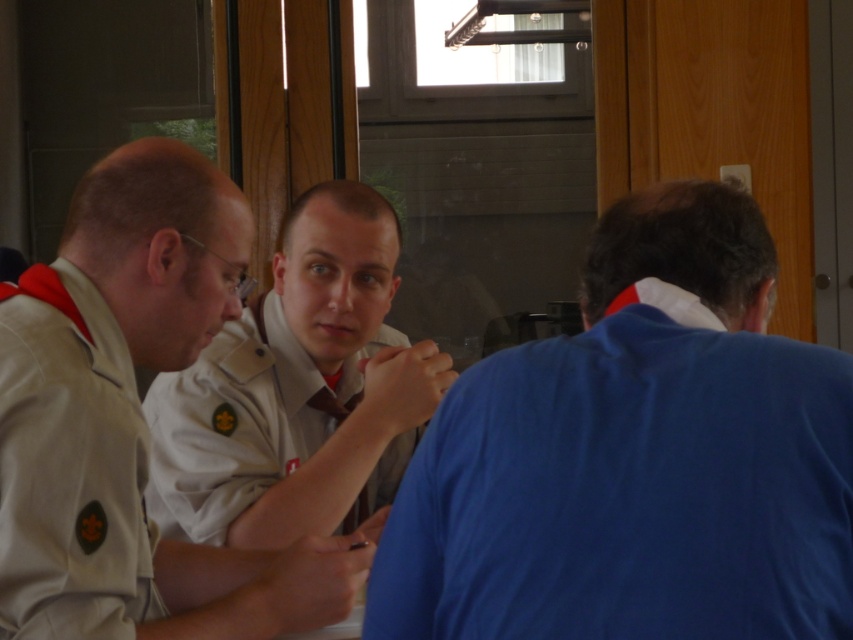
Question: Does khaki uniform shirt at center appear on the left side of tan uniform at left?

Choices:
 (A) yes
 (B) no

Answer: (B)

Question: Can you confirm if tan uniform at left is positioned above matte brown tie at center?

Choices:
 (A) yes
 (B) no

Answer: (A)

Question: Which of these objects is positioned farthest from the tan uniform at center?

Choices:
 (A) tan uniform at left
 (B) blue cotton shirt at right
 (C) khaki uniform shirt at center
 (D) matte brown tie at center

Answer: (B)

Question: Which object is farther from the camera taking this photo?

Choices:
 (A) blue cotton shirt at right
 (B) matte brown tie at center
 (C) tan uniform at center
 (D) tan uniform at left

Answer: (B)

Question: Is tan uniform at center closer to camera compared to matte brown tie at center?

Choices:
 (A) no
 (B) yes

Answer: (B)

Question: Which of the following is the closest to the observer?

Choices:
 (A) matte brown tie at center
 (B) tan uniform at left
 (C) tan uniform at center

Answer: (B)